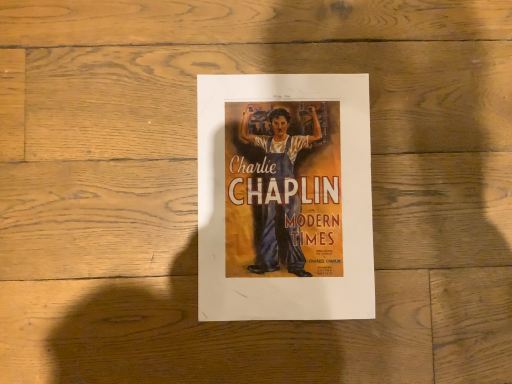
The width and height of the screenshot is (512, 384). I want to click on matte paper poster at center, so click(285, 197).

What do you see at coordinates (285, 197) in the screenshot? This screenshot has width=512, height=384. I see `matte paper poster at center` at bounding box center [285, 197].

Where is `matte paper poster at center`? matte paper poster at center is located at coordinates (285, 197).